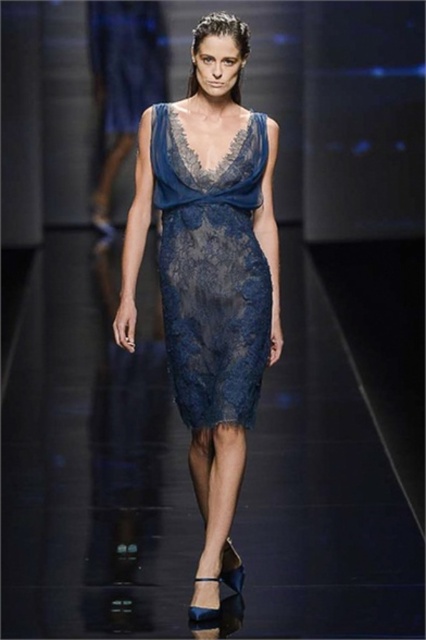
Who is positioned more to the right, lace dress at center or lace fabric dress at center?

lace dress at center is more to the right.

Which is above, lace dress at center or lace fabric dress at center?

Positioned higher is lace fabric dress at center.

Does point (209, 221) come closer to viewer compared to point (126, 122)?

Yes.

Image resolution: width=426 pixels, height=640 pixels. Identify the location of lace dress at center. (212, 272).

Who is higher up, navy lace dress at center or lace fabric dress at center?

lace fabric dress at center is above.

Image resolution: width=426 pixels, height=640 pixels. I want to click on navy lace dress at center, so click(x=210, y=275).

Based on the photo, which is below, navy lace dress at center or lace dress at center?

Positioned lower is navy lace dress at center.

In the scene shown: Which of these two, navy lace dress at center or lace dress at center, stands shorter?

lace dress at center is shorter.

Between point (204, 24) and point (192, 310), which one is positioned in front?

Point (204, 24)

What are the coordinates of `navy lace dress at center` in the screenshot? It's located at (210, 275).